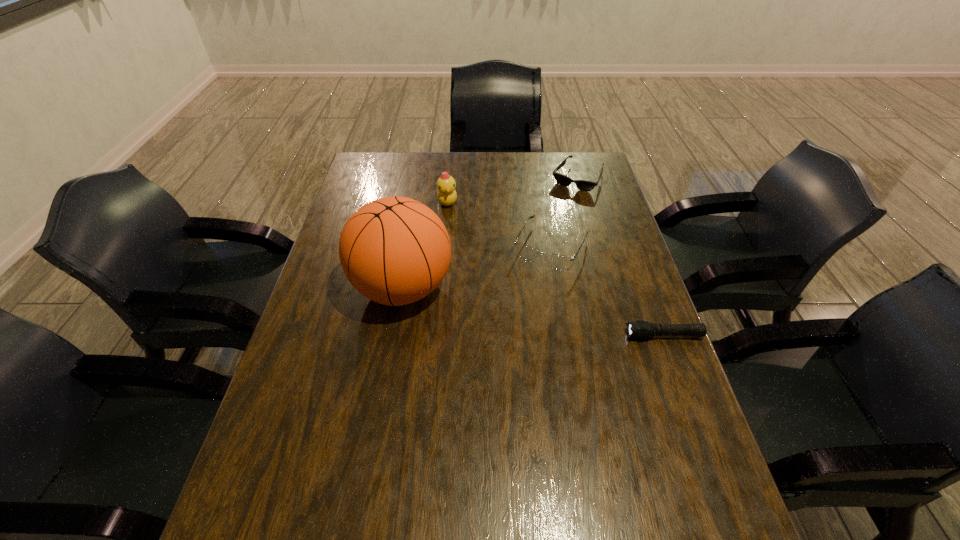
Where is `flashlight that is at the right edge`? flashlight that is at the right edge is located at coordinates (640, 329).

The height and width of the screenshot is (540, 960). Identify the location of spectacles that is positioned at the right edge. (558, 262).

This screenshot has height=540, width=960. I want to click on sunglasses that is at the right edge, so click(583, 185).

Image resolution: width=960 pixels, height=540 pixels. What are the coordinates of `object at the far right corner` in the screenshot? It's located at (583, 185).

The height and width of the screenshot is (540, 960). Find the location of `free space at the far edge`. free space at the far edge is located at coordinates (466, 152).

The image size is (960, 540). I want to click on vacant position at the near edge of the desktop, so click(x=593, y=474).

Where is `vacant region at the left edge of the desktop`? vacant region at the left edge of the desktop is located at coordinates (345, 394).

Find the location of a particular element. The height and width of the screenshot is (540, 960). vacant space at the right edge of the desktop is located at coordinates (593, 298).

This screenshot has width=960, height=540. In the image, there is a desktop. What are the coordinates of `vacant space at the far left corner` in the screenshot? It's located at (377, 176).

This screenshot has width=960, height=540. In order to click on vacant space that is in between the flashlight and the spectacles in this screenshot , I will do `click(608, 291)`.